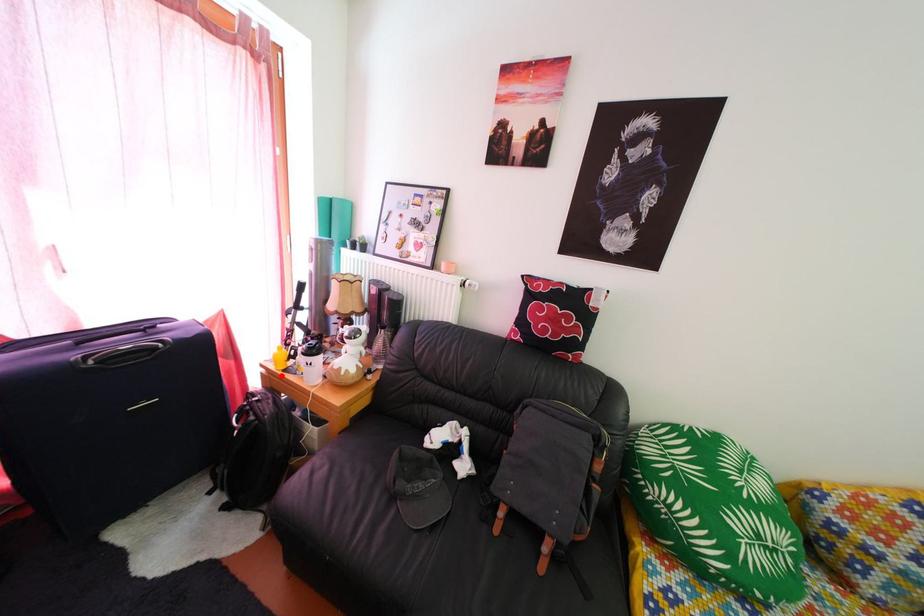
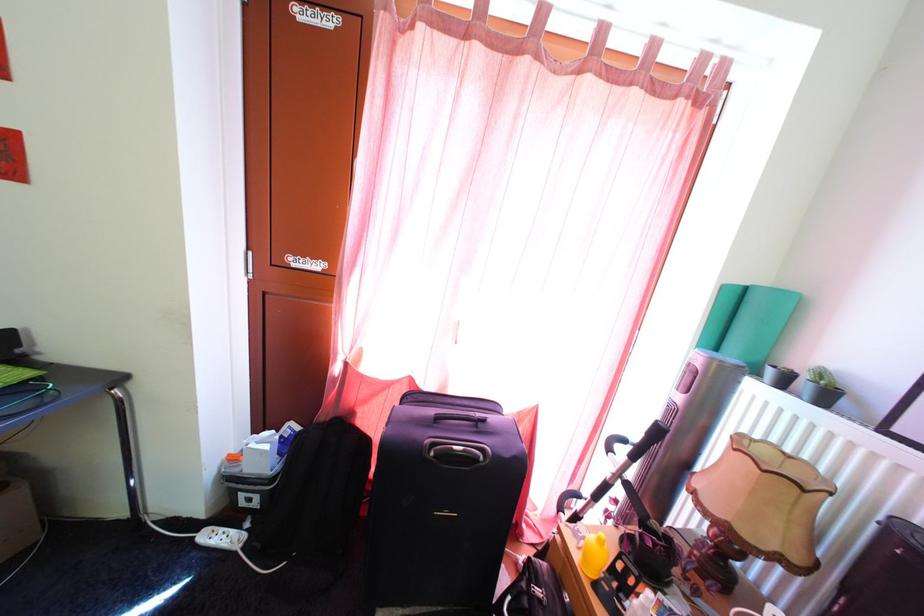
The point at the highlighted location is marked in the first image. Where is the corresponding point in the second image?

(585, 565)